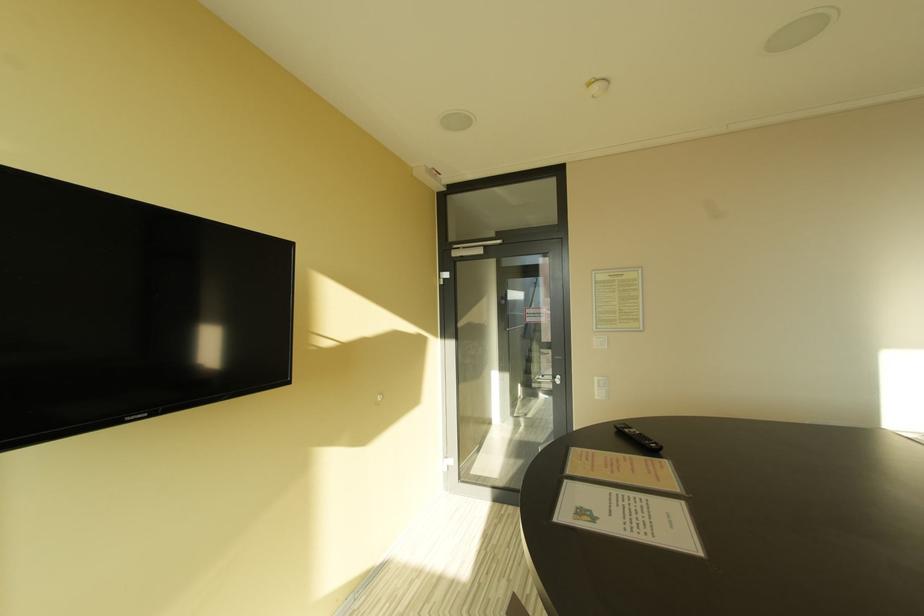
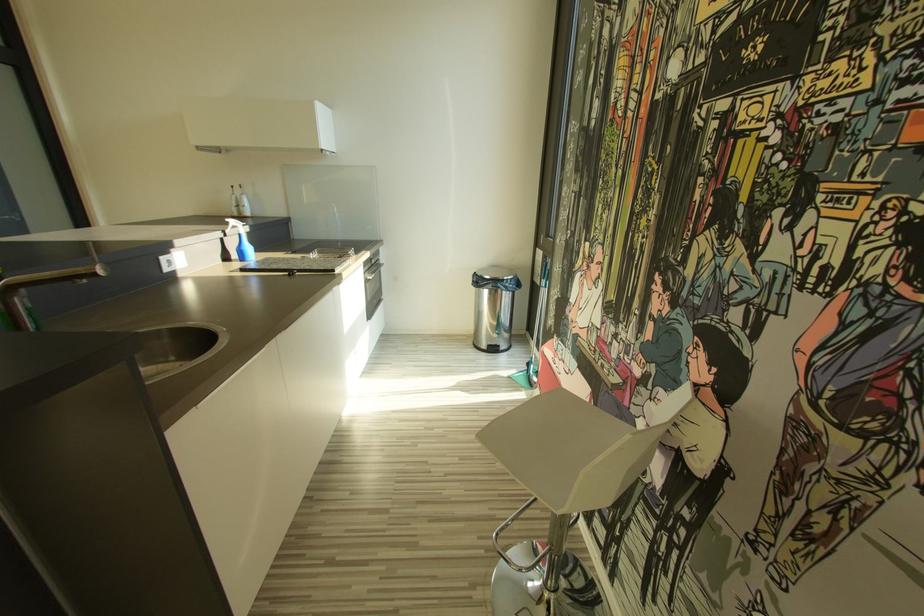
Based on the continuous images, in which direction is the camera rotating?

The camera's rotation is toward right-down.